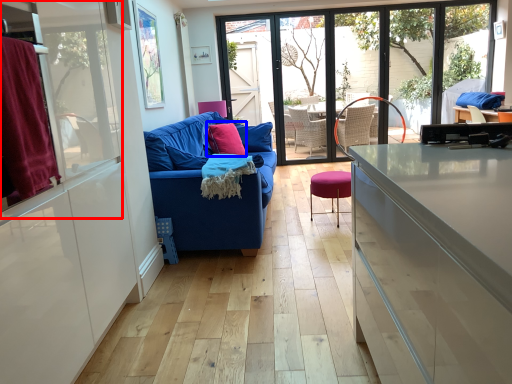
Question: Which object appears farthest to the camera in this image, window screen (highlighted by a red box) or pillow (highlighted by a blue box)?

Choices:
 (A) window screen
 (B) pillow

Answer: (B)